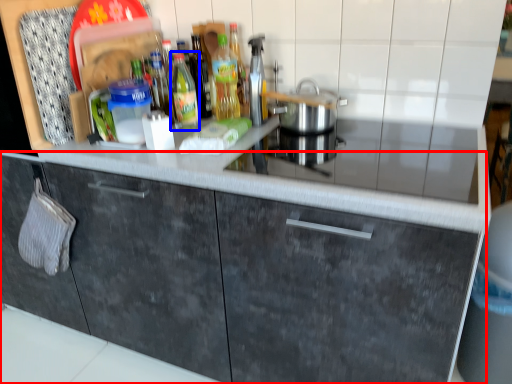
Question: Which object is further to the camera taking this photo, cabinetry (highlighted by a red box) or bottle (highlighted by a blue box)?

Choices:
 (A) cabinetry
 (B) bottle

Answer: (B)